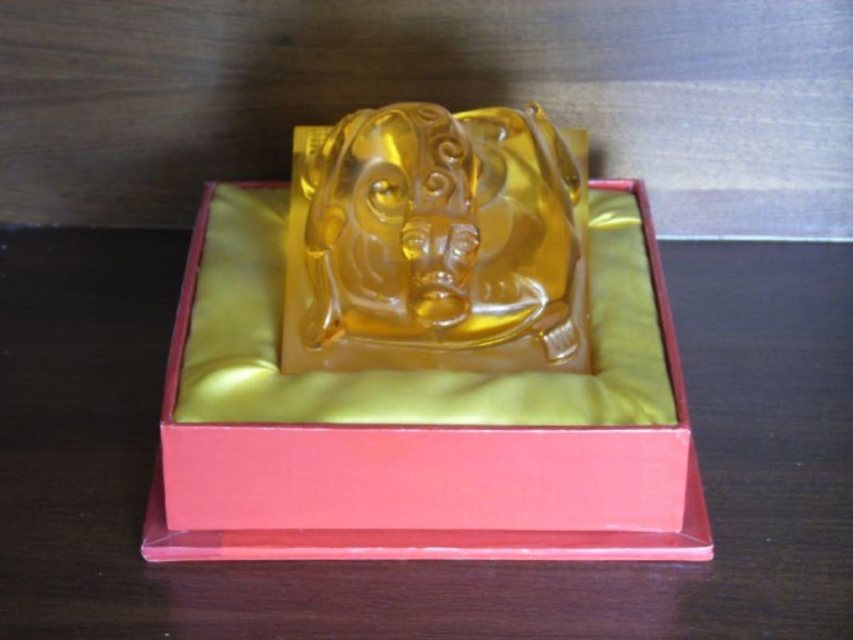
Question: Can you confirm if translucent amber statue at center is wider than translucent amber sculpture at center?

Choices:
 (A) yes
 (B) no

Answer: (A)

Question: Which of the following is the closest to the observer?

Choices:
 (A) (544, 362)
 (B) (628, 189)

Answer: (A)

Question: Does translucent amber statue at center appear under translucent amber sculpture at center?

Choices:
 (A) no
 (B) yes

Answer: (B)

Question: Can you confirm if translucent amber statue at center is positioned below translucent amber sculpture at center?

Choices:
 (A) no
 (B) yes

Answer: (B)